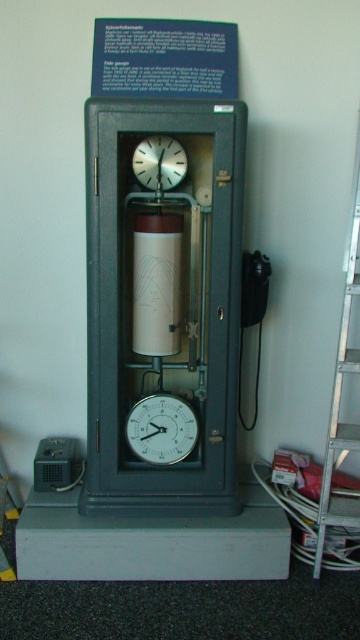
You are standing in front of the vintage tide gauge. There is a point at coordinates (340, 392). Which object in the scene does this point belong to?

The point at coordinates (340, 392) is on the silver metallic ladder at right.

You are a maintenance worker needing to reach the top of the silver metallic ladder at right and the white matte clock at center to clean them. Which object will require you to climb higher?

The silver metallic ladder at right is much taller than the white matte clock at center, so you will need to climb higher to reach the top of the silver metallic ladder at right.